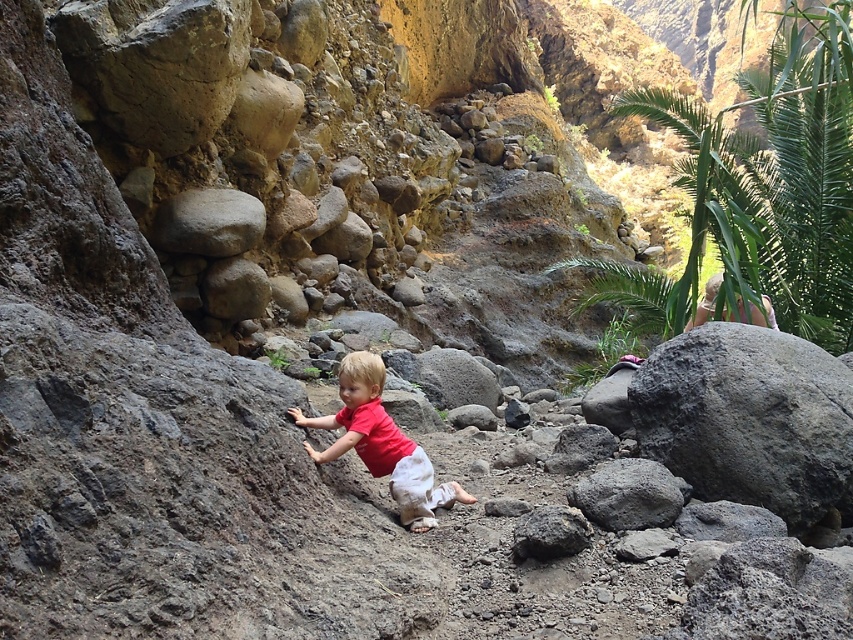
You are a hiker trying to reach the summit. You see the point marked at coordinate [749,419]. What is located there?

At point [749,419] lies volcanic rock boulder at right.

You are a photographer trying to capture the scene with the matte red shirt at center and the gray rough rock at upper center. Which object should you focus on first if you want to ensure both are in sharp focus, considering their relative heights?

The matte red shirt at center is much taller than the gray rough rock at upper center. To ensure both are in sharp focus, focus on the matte red shirt at center first since it is taller and likely closer to the camera.